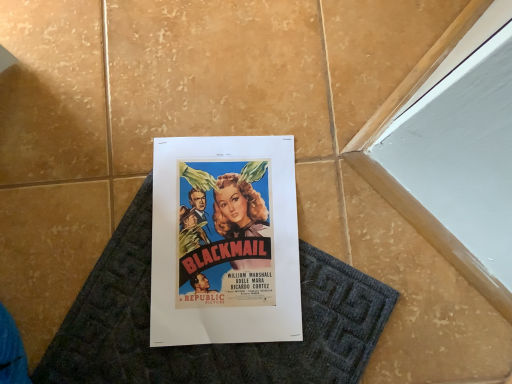
At what (x,y) coordinates should I click in order to perform the action: click on free point above matte paper poster at center (from a real-world perspective). Please return your answer as a coordinate pair (x, y). Image resolution: width=512 pixels, height=384 pixels. Looking at the image, I should click on (225, 238).